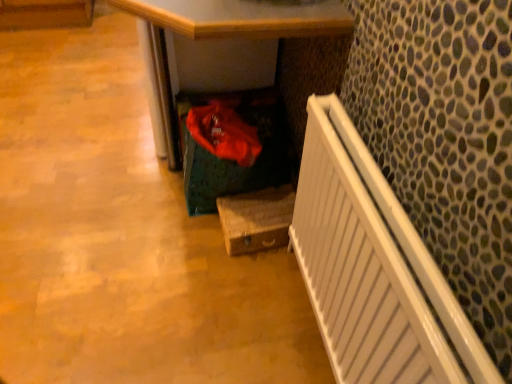
The width and height of the screenshot is (512, 384). Describe the element at coordinates (226, 34) in the screenshot. I see `wooden at lower center` at that location.

At what (x,y) coordinates should I click in order to perform the action: click on wooden at lower center. Please return your answer as a coordinate pair (x, y). Looking at the image, I should click on (226, 34).

Locate an element on the screen. wooden box at lower center is located at coordinates (256, 219).

What is the approximate height of white glossy radiator at right?

white glossy radiator at right is 30.22 inches in height.

This screenshot has width=512, height=384. I want to click on wooden at lower center, so click(226, 34).

Considering the positions of objects wooden at lower center and wooden box at lower center in the image provided, who is in front, wooden at lower center or wooden box at lower center?

wooden at lower center is closer to the camera.

Is wooden at lower center placed right next to wooden box at lower center?

wooden at lower center is not next to wooden box at lower center, and they're not touching.

From the image's perspective, which one is positioned higher, wooden at lower center or wooden box at lower center?

wooden at lower center, from the image's perspective.

Considering the positions of objects wooden at lower center and wooden box at lower center in the image provided, who is more to the right, wooden at lower center or wooden box at lower center?

wooden box at lower center is more to the right.

Find the location of a particular element. The image size is (512, 384). radiator located below the wooden at lower center (from the image's perspective) is located at coordinates (373, 269).

Relative to wooden at lower center, is white glossy radiator at right in front or behind?

white glossy radiator at right is in front of wooden at lower center.

Consider the image. Considering the sizes of objects white glossy radiator at right and wooden at lower center in the image provided, who is smaller, white glossy radiator at right or wooden at lower center?

white glossy radiator at right is smaller.

Is wooden box at lower center looking in the opposite direction of white glossy radiator at right?

That's not correct — wooden box at lower center is not looking away from white glossy radiator at right.

Is the surface of wooden box at lower center in direct contact with white glossy radiator at right?

No, wooden box at lower center is not beside white glossy radiator at right.

Between wooden box at lower center and white glossy radiator at right, which one is positioned behind?

Positioned behind is wooden box at lower center.

Could wooden box at lower center be considered to be inside white glossy radiator at right?

No.

Considering the positions of objects white glossy radiator at right and wooden box at lower center in the image provided, who is in front, white glossy radiator at right or wooden box at lower center?

white glossy radiator at right.

Which object is closer to the camera, wooden box at lower center or wooden at lower center?

wooden at lower center.

Which of these two, wooden box at lower center or wooden at lower center, is wider?

Wider between the two is wooden at lower center.

Measure the distance from wooden box at lower center to wooden at lower center.

wooden box at lower center is 21.46 inches away from wooden at lower center.

Can you tell me how much wooden at lower center and white glossy radiator at right differ in facing direction?

0.00279 degrees.

Is wooden at lower center oriented away from white glossy radiator at right?

No, wooden at lower center's orientation is not away from white glossy radiator at right.

Is wooden at lower center spatially inside white glossy radiator at right, or outside of it?

wooden at lower center is not inside white glossy radiator at right, it's outside.

From the picture: Between wooden at lower center and white glossy radiator at right, which one is positioned behind?

wooden at lower center is further away from the camera.

The width and height of the screenshot is (512, 384). Find the location of `desk on the left of wooden box at lower center`. desk on the left of wooden box at lower center is located at coordinates (226, 34).

Locate an element on the screen. The height and width of the screenshot is (384, 512). radiator beneath the wooden at lower center (from a real-world perspective) is located at coordinates (373, 269).

Considering their positions, is wooden box at lower center positioned closer to white glossy radiator at right than wooden at lower center?

wooden box at lower center.

Which object lies further to the anchor point wooden box at lower center, white glossy radiator at right or wooden at lower center?

Among the two, white glossy radiator at right is located further to wooden box at lower center.

Estimate the real-world distances between objects in this image. Which object is further from white glossy radiator at right, wooden at lower center or wooden box at lower center?

The object further to white glossy radiator at right is wooden at lower center.

Which object lies further to the anchor point wooden box at lower center, wooden at lower center or white glossy radiator at right?

The object further to wooden box at lower center is white glossy radiator at right.

From the image, which object appears to be nearer to wooden at lower center, wooden box at lower center or white glossy radiator at right?

Based on the image, wooden box at lower center appears to be nearer to wooden at lower center.

Which object lies further to the anchor point wooden at lower center, white glossy radiator at right or wooden box at lower center?

white glossy radiator at right is further to wooden at lower center.

Locate an element on the screen. The width and height of the screenshot is (512, 384). box between wooden at lower center and white glossy radiator at right vertically is located at coordinates (256, 219).